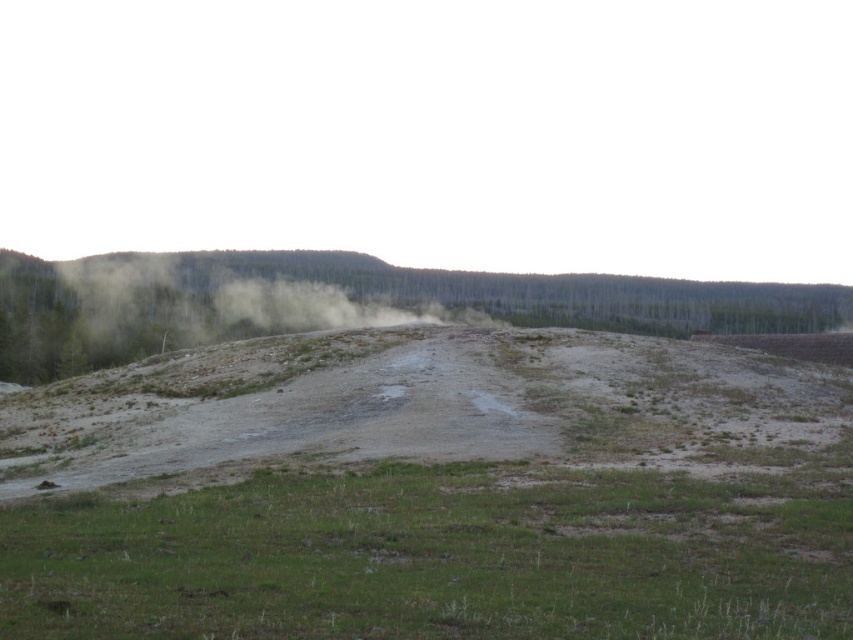
Question: Considering the relative positions of green fog at upper center and green leafy tree at center in the image provided, where is green fog at upper center located with respect to green leafy tree at center?

Choices:
 (A) left
 (B) right

Answer: (A)

Question: Does green fog at upper center come in front of green grassy at lower center?

Choices:
 (A) no
 (B) yes

Answer: (A)

Question: Which is nearer to the green fog at upper center?

Choices:
 (A) green grassy at lower center
 (B) green leafy tree at center

Answer: (B)

Question: Estimate the real-world distances between objects in this image. Which object is closer to the green fog at upper center?

Choices:
 (A) green grassy at lower center
 (B) green leafy tree at center

Answer: (B)

Question: Which is farther from the green leafy tree at center?

Choices:
 (A) green fog at upper center
 (B) green grassy at lower center

Answer: (B)

Question: From the image, what is the correct spatial relationship of green grassy at lower center in relation to green leafy tree at center?

Choices:
 (A) left
 (B) right

Answer: (A)